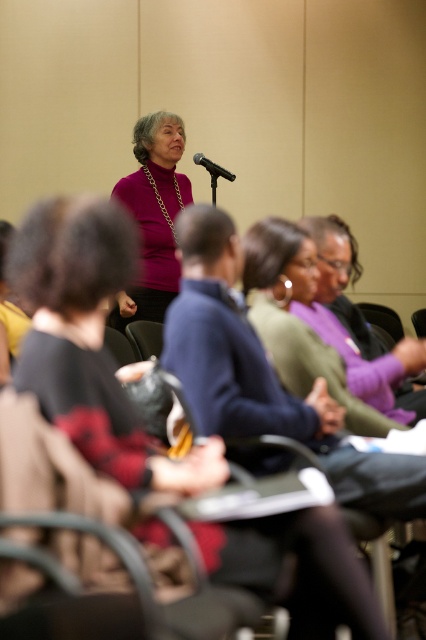
Based on the photo, which is more to the left, matte purple sweater at upper center or purple matte turtleneck sweater at center?

purple matte turtleneck sweater at center is more to the left.

Is point (218, 552) more distant than point (169, 145)?

No, it is in front of (169, 145).

The width and height of the screenshot is (426, 640). Identify the location of matte purple sweater at upper center. (91, 340).

Who is more distant from viewer, (83, 221) or (230, 177)?

The point (230, 177) is behind.

Is matte purple sweater at upper center positioned behind black matte microphone at center?

That is False.

Locate an element on the screen. Image resolution: width=426 pixels, height=640 pixels. matte purple sweater at upper center is located at coordinates (91, 340).

Where is `matte purple sweater at upper center`? matte purple sweater at upper center is located at coordinates (91, 340).

Which is below, purple matte turtleneck sweater at center or black matte microphone at center?

purple matte turtleneck sweater at center is below.

This screenshot has height=640, width=426. What do you see at coordinates (154, 214) in the screenshot? I see `purple matte turtleneck sweater at center` at bounding box center [154, 214].

Which is behind, point (158, 230) or point (213, 170)?

The point (213, 170) is behind.

The image size is (426, 640). In order to click on purple matte turtleneck sweater at center in this screenshot , I will do `click(154, 214)`.